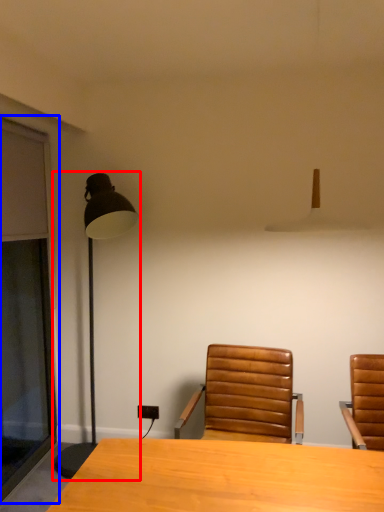
Question: Which point is closer to the camera, lamp (highlighted by a red box) or screen door (highlighted by a blue box)?

Choices:
 (A) lamp
 (B) screen door

Answer: (B)